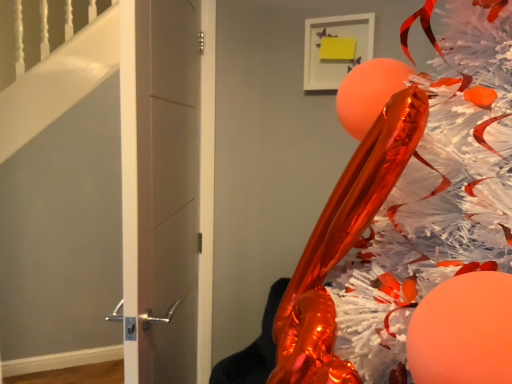
What do you see at coordinates (160, 187) in the screenshot? I see `matte gray door at center` at bounding box center [160, 187].

What are the coordinates of `matte gray door at center` in the screenshot? It's located at (160, 187).

This screenshot has width=512, height=384. What do you see at coordinates (408, 212) in the screenshot?
I see `shiny metallic christmas tree at right` at bounding box center [408, 212].

Find the location of a particular element. shiny metallic christmas tree at right is located at coordinates (408, 212).

What is the approximate width of shiny metallic christmas tree at right?

33.87 inches.

The width and height of the screenshot is (512, 384). I want to click on matte gray door at center, so (160, 187).

Considering the positions of objects shiny metallic christmas tree at right and matte gray door at center in the image provided, who is more to the left, shiny metallic christmas tree at right or matte gray door at center?

Positioned to the left is matte gray door at center.

Is shiny metallic christmas tree at right further to the viewer compared to matte gray door at center?

No, it is not.

Considering the points (493, 43) and (157, 313), which point is in front, point (493, 43) or point (157, 313)?

Positioned in front is point (493, 43).

From the image's perspective, is shiny metallic christmas tree at right above or below matte gray door at center?

Clearly, from the image's perspective, shiny metallic christmas tree at right is below matte gray door at center.

From a real-world perspective, between shiny metallic christmas tree at right and matte gray door at center, who is vertically higher?

shiny metallic christmas tree at right.

Is shiny metallic christmas tree at right thinner than matte gray door at center?

No, shiny metallic christmas tree at right is not thinner than matte gray door at center.

Is shiny metallic christmas tree at right taller than matte gray door at center?

In fact, shiny metallic christmas tree at right may be shorter than matte gray door at center.

Who is smaller, shiny metallic christmas tree at right or matte gray door at center?

matte gray door at center is smaller.

Is shiny metallic christmas tree at right completely or partially outside of matte gray door at center?

Yes, shiny metallic christmas tree at right is located beyond the bounds of matte gray door at center.

Is shiny metallic christmas tree at right touching matte gray door at center?

No, shiny metallic christmas tree at right is not making contact with matte gray door at center.

From the picture: Is shiny metallic christmas tree at right oriented towards matte gray door at center?

No, shiny metallic christmas tree at right does not turn towards matte gray door at center.

How many degrees apart are the facing directions of shiny metallic christmas tree at right and matte gray door at center?

26.1 degrees separate the facing orientations of shiny metallic christmas tree at right and matte gray door at center.

The image size is (512, 384). I want to click on christmas tree above the matte gray door at center (from a real-world perspective), so click(408, 212).

Does matte gray door at center appear on the left side of shiny metallic christmas tree at right?

Yes.

Is matte gray door at center further to camera compared to shiny metallic christmas tree at right?

Yes, matte gray door at center is further from the viewer.

Does point (125, 206) come in front of point (492, 144)?

No, (125, 206) is further to viewer.

From the image's perspective, which object appears higher, matte gray door at center or shiny metallic christmas tree at right?

matte gray door at center appears higher in the image.

From a real-world perspective, which object rests below the other?

matte gray door at center is physically lower.

Can you confirm if matte gray door at center is wider than shiny metallic christmas tree at right?

In fact, matte gray door at center might be narrower than shiny metallic christmas tree at right.

Considering the sizes of objects matte gray door at center and shiny metallic christmas tree at right in the image provided, who is shorter, matte gray door at center or shiny metallic christmas tree at right?

Standing shorter between the two is shiny metallic christmas tree at right.

Between matte gray door at center and shiny metallic christmas tree at right, which one has smaller size?

With smaller size is matte gray door at center.

Is shiny metallic christmas tree at right inside matte gray door at center?

No.

Consider the image. Is there a large distance between matte gray door at center and shiny metallic christmas tree at right?

No.

Is matte gray door at center oriented towards shiny metallic christmas tree at right?

No, matte gray door at center does not turn towards shiny metallic christmas tree at right.

What's the angular difference between matte gray door at center and shiny metallic christmas tree at right's facing directions?

There is a 26.1-degree angle between the facing directions of matte gray door at center and shiny metallic christmas tree at right.

Find the location of a particular element. The width and height of the screenshot is (512, 384). christmas tree in front of the matte gray door at center is located at coordinates (408, 212).

Locate an element on the screen. Image resolution: width=512 pixels, height=384 pixels. door located on the left of shiny metallic christmas tree at right is located at coordinates (160, 187).

Where is `christmas tree that is in front of the matte gray door at center`? This screenshot has width=512, height=384. christmas tree that is in front of the matte gray door at center is located at coordinates (408, 212).